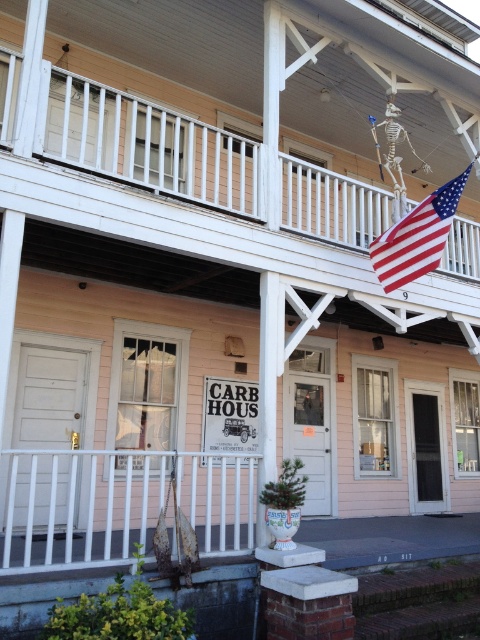
You are standing at the front entrance of the two story building. You notice a point marked at coordinates (x=120, y=502). What object at the building corresponds to this point?

The point at coordinates (x=120, y=502) corresponds to the white metal rail at lower left.

You are standing in front of the building and want to hang a new small decoration. The decoration requires a support structure that is at least 1.5 meters tall. Based on the scene, which object between the white metal rail at lower left and the american flag at upper right would be suitable for hanging the decoration?

The white metal rail at lower left is taller than the american flag at upper right, so the white metal rail at lower left would be suitable for hanging the decoration as it meets the height requirement.